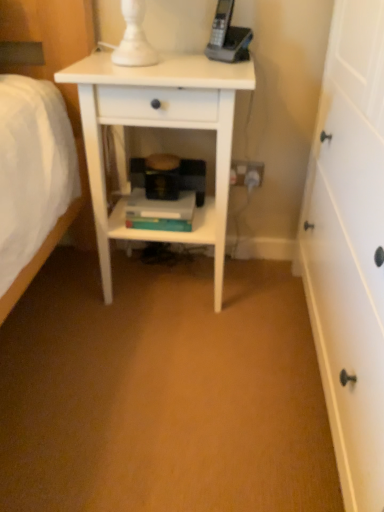
What are the coordinates of `free spot in front of white matte nightstand at center` in the screenshot? It's located at (158, 361).